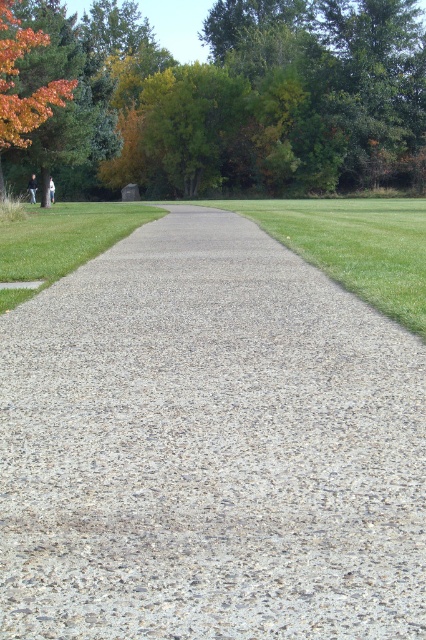
You are a gardener planning to mow the green grass at center. However, you notice the green leafy tree at upper center nearby. Will the tree obstruct the mowing path? Please explain based on their sizes.

The green leafy tree at upper center is larger than the green grass at center, so it will likely obstruct the mowing path.

You are a gardener planning to walk along the gray gravel at center and the orange leafy tree at upper left. Which path feature has a narrower width?

The gray gravel at center has a lesser width compared to the orange leafy tree at upper left.